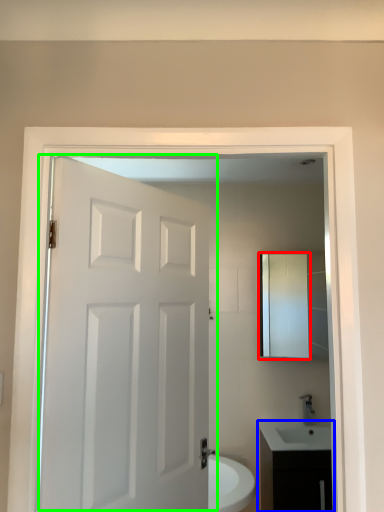
Question: Based on their relative distances, which object is nearer to medicine cabinet (highlighted by a red box)? Choose from bathroom cabinet (highlighted by a blue box) and door (highlighted by a green box).

Choices:
 (A) bathroom cabinet
 (B) door

Answer: (A)